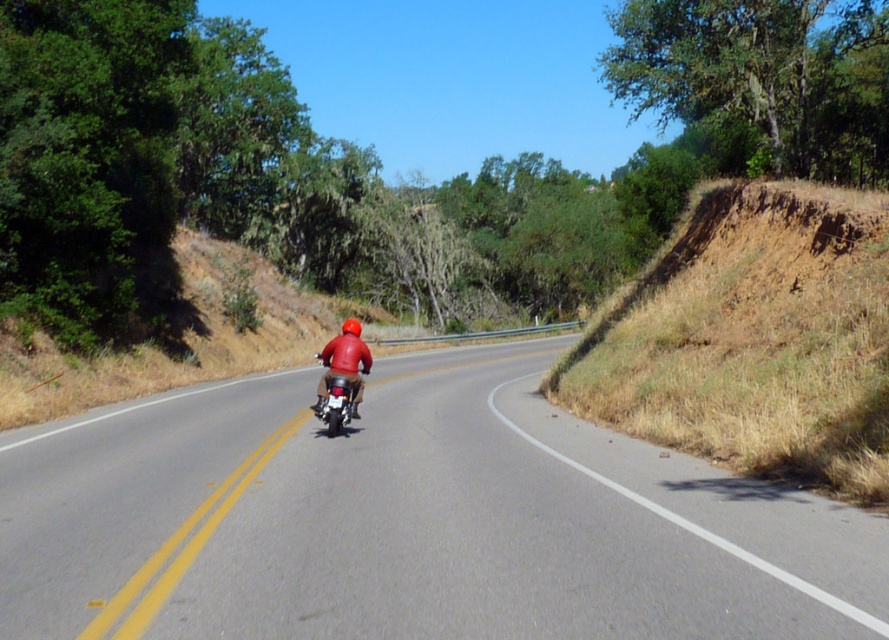
Is gray asphalt road at center in front of shiny chrome motorcycle at center?

Yes, gray asphalt road at center is in front of shiny chrome motorcycle at center.

Can you confirm if gray asphalt road at center is thinner than shiny chrome motorcycle at center?

No, gray asphalt road at center is not thinner than shiny chrome motorcycle at center.

Who is more forward, (3, 476) or (345, 406)?

Point (3, 476)

Identify the location of gray asphalt road at center. (410, 522).

Can you confirm if gray asphalt road at center is positioned above dry grass at right?

No.

From the picture: Which of these two, gray asphalt road at center or dry grass at right, stands shorter?

gray asphalt road at center is shorter.

Locate an element on the screen. gray asphalt road at center is located at coordinates (410, 522).

Find the location of a particular element. This screenshot has height=640, width=889. gray asphalt road at center is located at coordinates (410, 522).

Which is behind, point (707, 285) or point (357, 336)?

The point (707, 285) is behind.

Does dry grass at right come in front of matte red helmet at center?

Yes.

The height and width of the screenshot is (640, 889). What are the coordinates of `dry grass at right` in the screenshot? It's located at (753, 337).